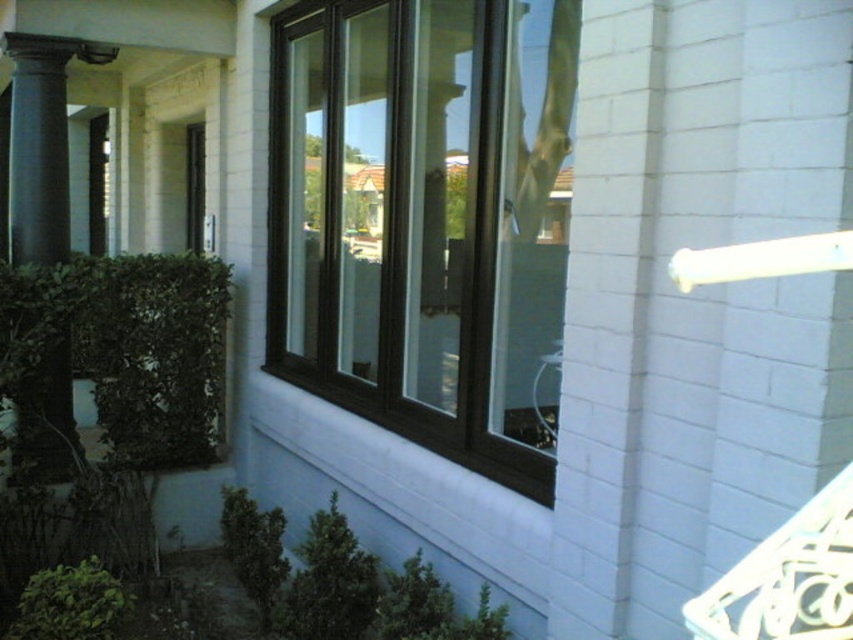
Is the position of brown wood window at center less distant than that of dark gray stone column at left?

Yes.

At what (x,y) coordinates should I click in order to perform the action: click on brown wood window at center. Please return your answer as a coordinate pair (x, y). The width and height of the screenshot is (853, 640). Looking at the image, I should click on (424, 220).

In order to click on brown wood window at center in this screenshot , I will do `click(424, 220)`.